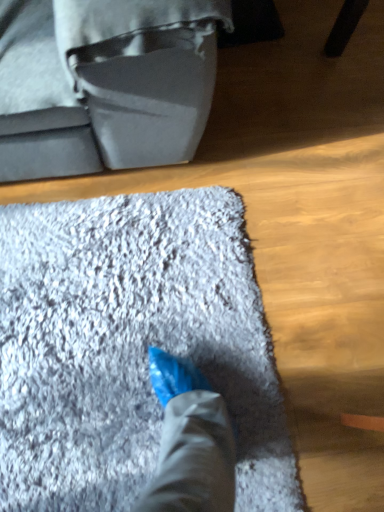
You are a GUI agent. You are given a task and a screenshot of the screen. Output one action in this format:
    pyautogui.click(x=<x>, y=<y>)
    Task: Click on the gray shaggy bath mat at center
    The image size is (384, 512).
    Given the screenshot: What is the action you would take?
    pyautogui.click(x=129, y=347)

This screenshot has width=384, height=512. What do you see at coordinates (129, 347) in the screenshot?
I see `gray shaggy bath mat at center` at bounding box center [129, 347].

Identify the location of gray shaggy bath mat at center. (129, 347).